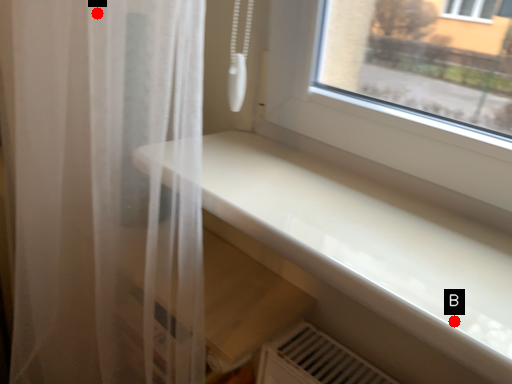
Question: Two points are circled on the image, labeled by A and B beside each circle. Which point appears closest to the camera in this image?

Choices:
 (A) A is closer
 (B) B is closer

Answer: (B)